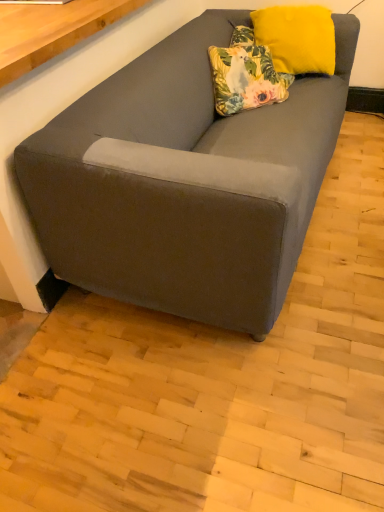
Question: In terms of width, does floral fabric pillow at upper center, positioned as the 1th pillow in left-to-right order, look wider or thinner when compared to suede gray couch at lower left?

Choices:
 (A) wide
 (B) thin

Answer: (B)

Question: Based on their sizes in the image, would you say floral fabric pillow at upper center, the second pillow viewed from the right, is bigger or smaller than suede gray couch at lower left?

Choices:
 (A) small
 (B) big

Answer: (A)

Question: Which is nearer to the suede gray couch at lower left?

Choices:
 (A) floral fabric pillow at upper center, the second pillow viewed from the right
 (B) yellow velvet pillow at upper right, the second pillow from the left

Answer: (A)

Question: Estimate the real-world distances between objects in this image. Which object is farther from the floral fabric pillow at upper center, positioned as the 1th pillow in left-to-right order?

Choices:
 (A) yellow velvet pillow at upper right, marked as the 1th pillow in a right-to-left arrangement
 (B) suede gray couch at lower left

Answer: (B)